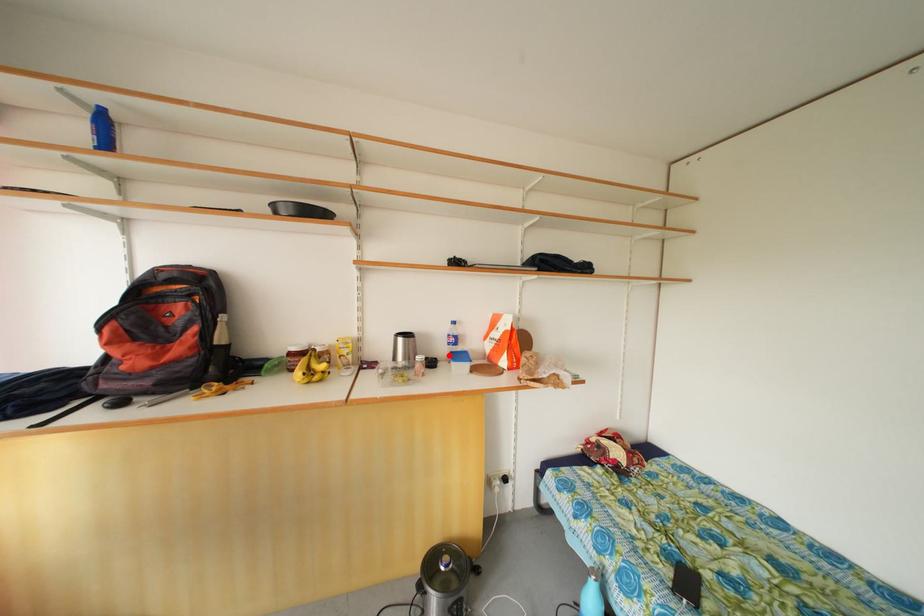
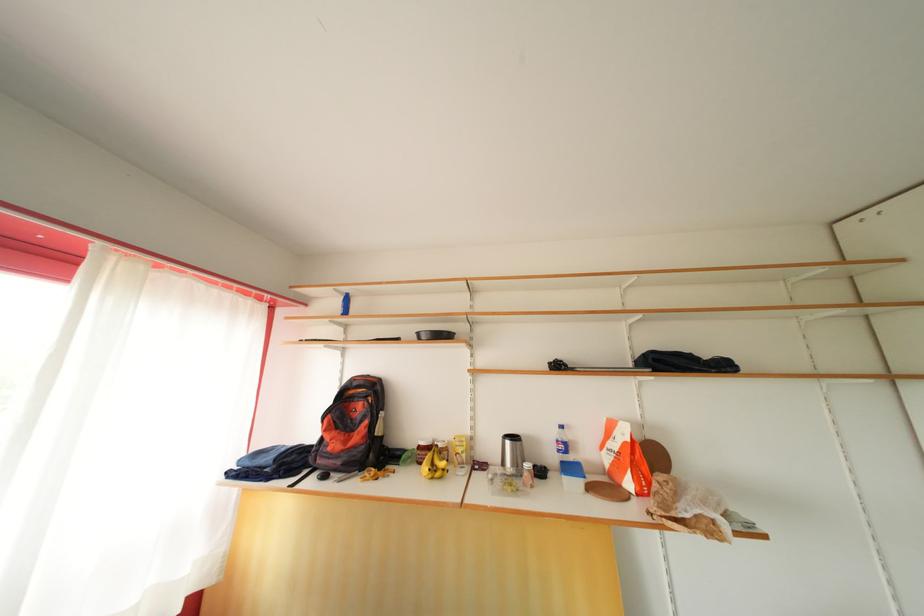
The point at the highlighted location is marked in the first image. Where is the corresponding point in the second image?

(558, 463)